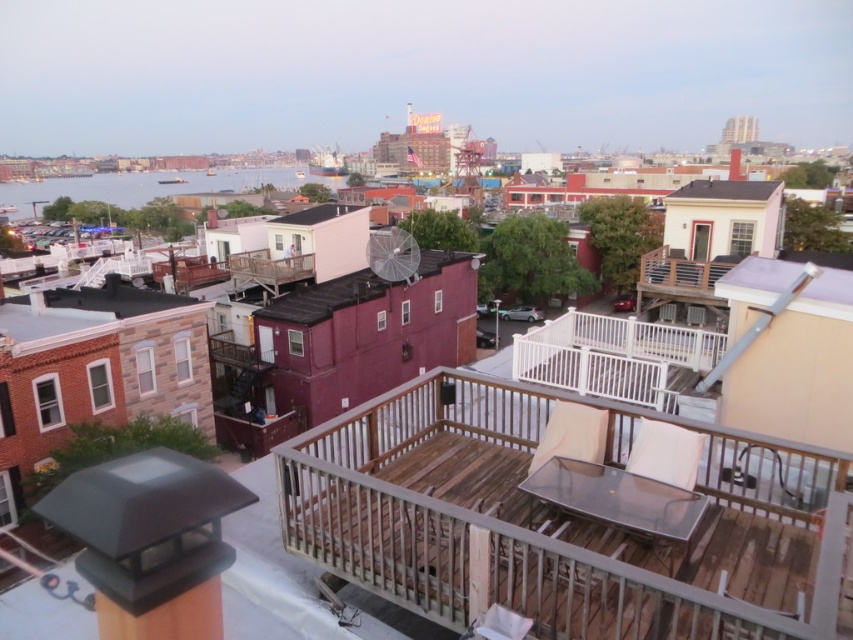
You are standing on the rooftop deck and want to get to the white wood balcony at center. Which direction should you move relative to the blue water at left?

You should move to the right relative to the blue water at left because the white wood balcony at center is positioned on the right side of blue water at left.

From the picture: You are planning to host a small gathering on the rooftop and need to choose between the brown wooden deck at center and the white wood balcony at center. Which area can accommodate more guests comfortably?

The white wood balcony at center has a larger size compared to the brown wooden deck at center, so it can accommodate more guests comfortably.